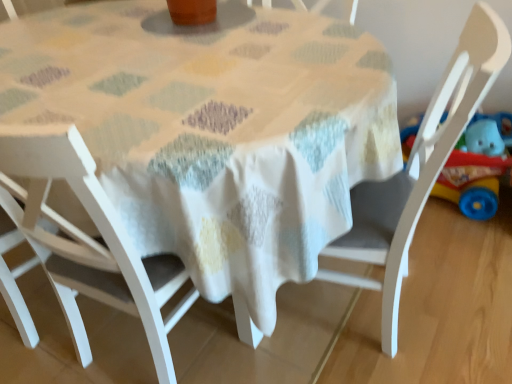
Question: Which direction should I rotate to look at white wood chair at center, the 1th chair positioned from the right, — up or down?

Choices:
 (A) down
 (B) up

Answer: (B)

Question: Is white wood chair at center, marked as the 2th chair in a right-to-left arrangement, outside of white wood chair at lower left, the first chair from the left?

Choices:
 (A) yes
 (B) no

Answer: (A)

Question: From a real-world perspective, is white wood chair at center, which ranks as the second chair in left-to-right order, over white wood chair at lower left, which appears as the 3th chair when viewed from the right?

Choices:
 (A) no
 (B) yes

Answer: (A)

Question: From the image's perspective, is white wood chair at center, which ranks as the second chair in left-to-right order, below white wood chair at lower left, the first chair from the left?

Choices:
 (A) yes
 (B) no

Answer: (A)

Question: Can you confirm if white wood chair at center, which ranks as the second chair in left-to-right order, is positioned to the right of white wood chair at lower left, the first chair from the left?

Choices:
 (A) no
 (B) yes

Answer: (B)

Question: Can you confirm if white wood chair at center, marked as the 2th chair in a right-to-left arrangement, is wider than white wood chair at lower left, the first chair from the left?

Choices:
 (A) yes
 (B) no

Answer: (A)

Question: Can you confirm if white wood chair at center, marked as the 2th chair in a right-to-left arrangement, is taller than white wood chair at lower left, which appears as the 3th chair when viewed from the right?

Choices:
 (A) no
 (B) yes

Answer: (B)

Question: Considering the relative sizes of white fabric table at center and white wood chair at center, marked as the 2th chair in a right-to-left arrangement, in the image provided, is white fabric table at center shorter than white wood chair at center, marked as the 2th chair in a right-to-left arrangement,?

Choices:
 (A) no
 (B) yes

Answer: (B)

Question: Is white fabric table at center bigger than white wood chair at center, marked as the 2th chair in a right-to-left arrangement?

Choices:
 (A) yes
 (B) no

Answer: (A)

Question: Are white fabric table at center and white wood chair at center, marked as the 2th chair in a right-to-left arrangement, beside each other?

Choices:
 (A) yes
 (B) no

Answer: (B)

Question: Is white fabric table at center at the right side of white wood chair at center, which ranks as the second chair in left-to-right order?

Choices:
 (A) no
 (B) yes

Answer: (B)

Question: Does white fabric table at center have a greater height compared to white wood chair at center, marked as the 2th chair in a right-to-left arrangement?

Choices:
 (A) no
 (B) yes

Answer: (A)

Question: Can you confirm if white fabric table at center is wider than white wood chair at center, which ranks as the second chair in left-to-right order?

Choices:
 (A) yes
 (B) no

Answer: (A)

Question: Is white wood chair at center, marked as the 3th chair in a left-to-right arrangement, further to camera compared to white wood chair at lower left, the first chair from the left?

Choices:
 (A) no
 (B) yes

Answer: (A)